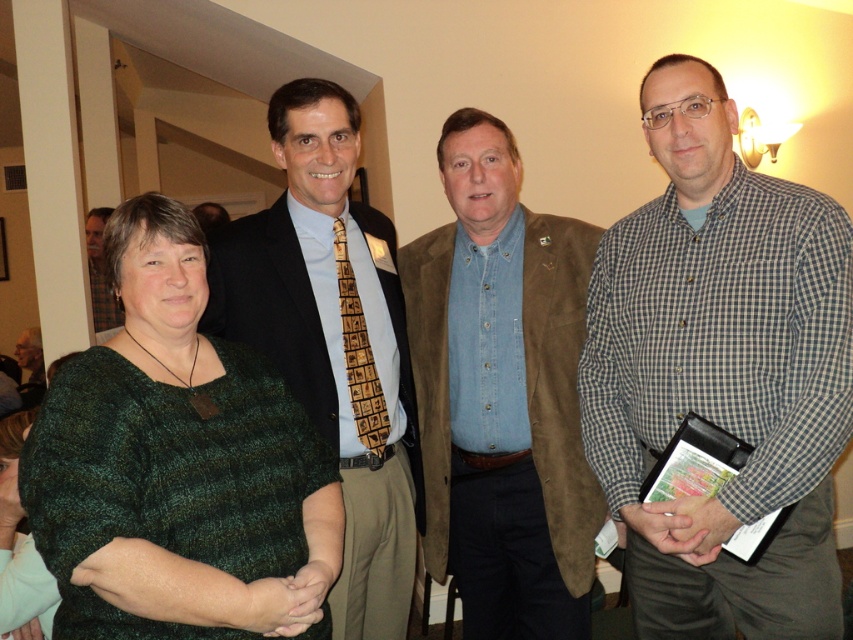
Question: Is brown woven tie at center further to the viewer compared to green textured sweater at lower left?

Choices:
 (A) yes
 (B) no

Answer: (B)

Question: Considering the relative positions of denim shirt at center and dark brown suit at center in the image provided, where is denim shirt at center located with respect to dark brown suit at center?

Choices:
 (A) right
 (B) left

Answer: (A)

Question: Can you confirm if green knitted sweater at lower left is smaller than brown woven tie at center?

Choices:
 (A) yes
 (B) no

Answer: (B)

Question: Which of the following is the closest to the observer?

Choices:
 (A) dark brown suit at center
 (B) green knitted sweater at lower left
 (C) green knitted sweater at left

Answer: (C)

Question: Which of the following is the closest to the observer?

Choices:
 (A) (289, 224)
 (B) (445, 404)
 (C) (13, 580)

Answer: (C)

Question: Which object is positioned farthest from the green knitted sweater at lower left?

Choices:
 (A) dark brown suit at center
 (B) checkered fabric shirt at center
 (C) denim shirt at center

Answer: (B)